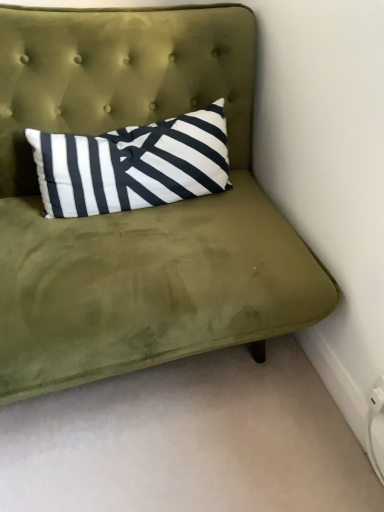
Question: Considering the relative positions of velvet green headboard at upper center and white plastic electric outlet at lower right in the image provided, is velvet green headboard at upper center to the left or to the right of white plastic electric outlet at lower right?

Choices:
 (A) right
 (B) left

Answer: (B)

Question: From the image's perspective, is velvet green headboard at upper center located above or below white plastic electric outlet at lower right?

Choices:
 (A) below
 (B) above

Answer: (B)

Question: Which object is positioned farthest from the white plastic electric outlet at lower right?

Choices:
 (A) olive green velvet couch at upper center
 (B) velvet green headboard at upper center

Answer: (B)

Question: Based on their relative distances, which object is farther from the velvet green headboard at upper center?

Choices:
 (A) olive green velvet couch at upper center
 (B) white plastic electric outlet at lower right

Answer: (B)